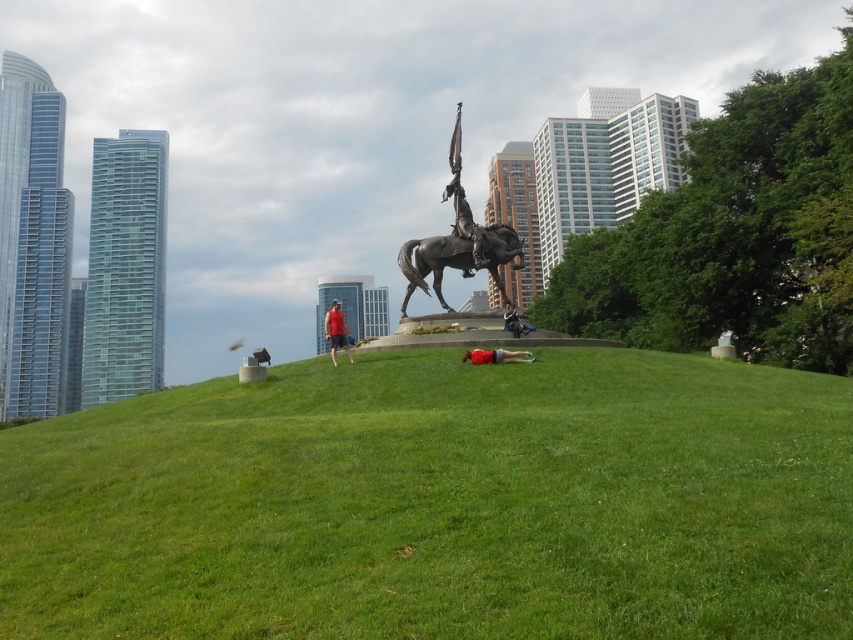
Question: Is red fabric person at center positioned behind denim jacket at center?

Choices:
 (A) no
 (B) yes

Answer: (A)

Question: Among these objects, which one is farthest from the camera?

Choices:
 (A) bronze metallic horseman at center
 (B) red fabric person at center

Answer: (A)

Question: Which of these objects is positioned farthest from the green grassy hill at center?

Choices:
 (A) polished bronze horse at center
 (B) denim jacket at center

Answer: (A)

Question: Can you confirm if green grassy hill at center is thinner than denim jacket at center?

Choices:
 (A) yes
 (B) no

Answer: (B)

Question: From the image, what is the correct spatial relationship of polished bronze horse at center in relation to red fabric person at center?

Choices:
 (A) above
 (B) below

Answer: (A)

Question: Which of the following is the closest to the observer?

Choices:
 (A) matte red shirt at center
 (B) denim jacket at center
 (C) bronze metallic horseman at center
 (D) green grassy hill at center

Answer: (D)